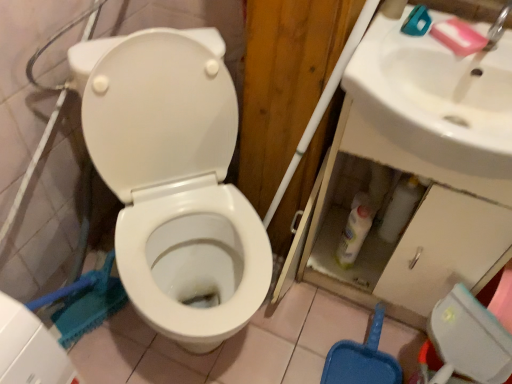
Question: In terms of width, does pink matte soap at upper right look wider or thinner when compared to white glossy sink at upper right?

Choices:
 (A) thin
 (B) wide

Answer: (A)

Question: In the image, is pink matte soap at upper right positioned in front of or behind white glossy sink at upper right?

Choices:
 (A) behind
 (B) front

Answer: (A)

Question: Estimate the real-world distances between objects in this image. Which object is closer to the white glossy sink at upper right?

Choices:
 (A) pink matte soap at upper right
 (B) white glossy bottle at lower center
 (C) white glossy toilet at center

Answer: (A)

Question: Which is nearer to the white glossy sink at upper right?

Choices:
 (A) white glossy toilet at center
 (B) pink matte soap at upper right
 (C) white glossy bottle at lower center

Answer: (B)